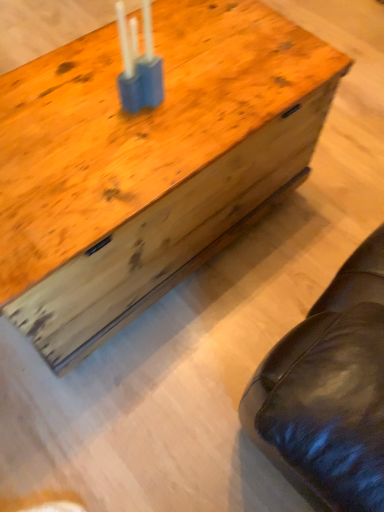
Locate an element on the screen. The image size is (384, 512). vacant area that lies to the right of blue plastic candle holder at center is located at coordinates (204, 100).